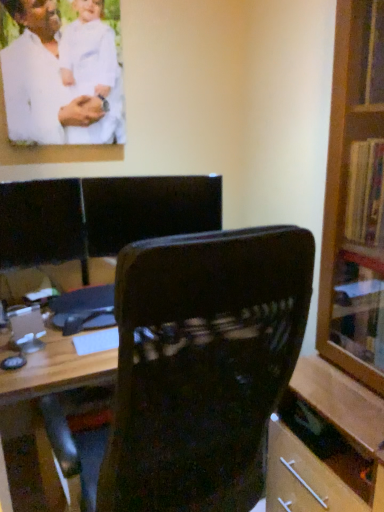
Question: Considering the positions of white matte shirt at upper left and velvet-like dark brown chair at center in the image, is white matte shirt at upper left taller or shorter than velvet-like dark brown chair at center?

Choices:
 (A) short
 (B) tall

Answer: (A)

Question: Considering the positions of white matte shirt at upper left and velvet-like dark brown chair at center in the image, is white matte shirt at upper left bigger or smaller than velvet-like dark brown chair at center?

Choices:
 (A) big
 (B) small

Answer: (B)

Question: Which object is the closest to the wooden bookcase at right?

Choices:
 (A) black leather chair at center
 (B) white matte shirt at upper left
 (C) velvet-like dark brown chair at center

Answer: (C)

Question: Which is farther from the wooden bookcase at right?

Choices:
 (A) black leather chair at center
 (B) white matte shirt at upper left
 (C) velvet-like dark brown chair at center

Answer: (B)